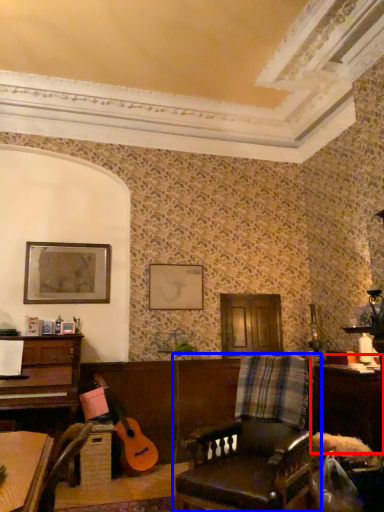
Question: Which of the following is the closest to the observer, table (highlighted by a red box) or chair (highlighted by a blue box)?

Choices:
 (A) table
 (B) chair

Answer: (B)